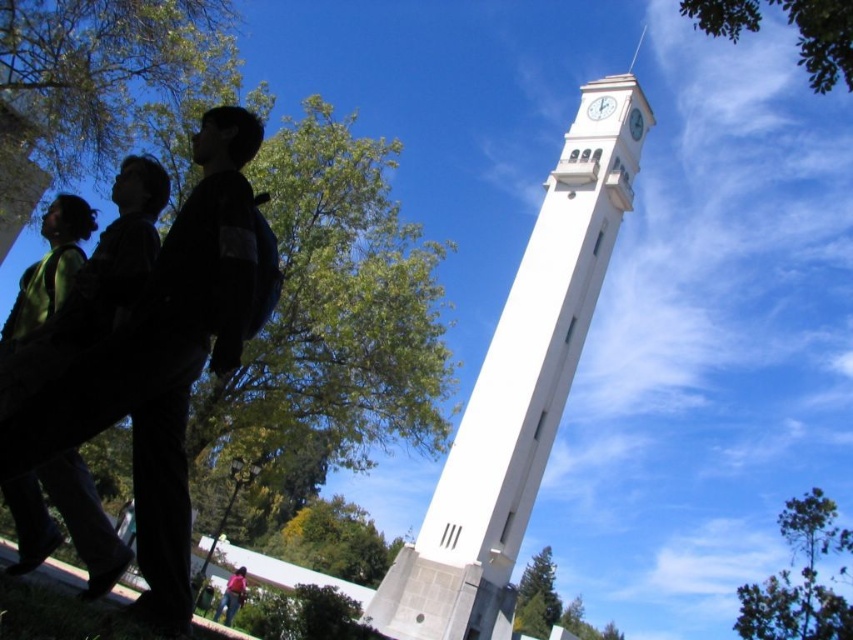
In the scene shown: You are standing in front of the white concrete clock tower at center and notice the pink fabric pants at lower center. Which object takes up more horizontal space in the image?

The white concrete clock tower at center takes up more horizontal space than the pink fabric pants at lower center because its width surpasses the pants.

You are standing at the base of the tall white clock tower and notice two clocks at the upper center. Which clock is closer to you, the white glossy clock at upper center or the white smooth clock at upper center?

The white glossy clock at upper center is closer to you because it is further to the viewer than the white smooth clock at upper center.